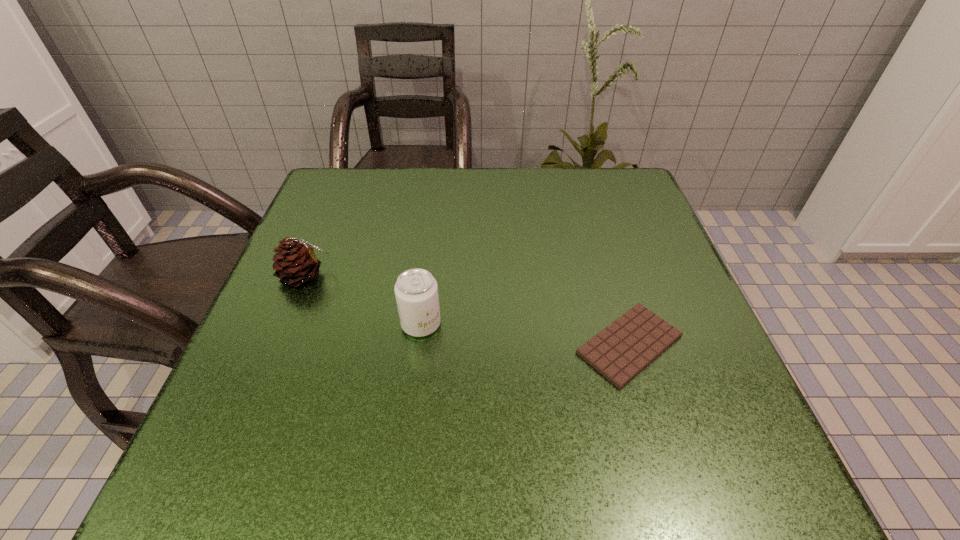
Where is `free spot between the second object from right to left and the chocolate bar`? The height and width of the screenshot is (540, 960). free spot between the second object from right to left and the chocolate bar is located at coordinates (525, 334).

Locate an element on the screen. free spot between the rightmost object and the second object from right to left is located at coordinates (525, 334).

Find the location of a particular element. The height and width of the screenshot is (540, 960). vacant area that lies between the soda can and the pinecone is located at coordinates (363, 300).

I want to click on vacant space in between the farthest object and the soda can, so click(x=363, y=300).

Locate an element on the screen. vacant area that lies between the chocolate bar and the soda can is located at coordinates (525, 334).

Where is `vacant area between the chocolate bar and the second object from left to right`? Image resolution: width=960 pixels, height=540 pixels. vacant area between the chocolate bar and the second object from left to right is located at coordinates (525, 334).

Choose which object is the nearest neighbor to the farthest object. Please provide its 2D coordinates. Your answer should be formatted as a tuple, i.e. [(x, y)], where the tuple contains the x and y coordinates of a point satisfying the conditions above.

[(416, 290)]

Identify which object is located as the nearest to the chocolate bar. Please provide its 2D coordinates. Your answer should be formatted as a tuple, i.e. [(x, y)], where the tuple contains the x and y coordinates of a point satisfying the conditions above.

[(416, 290)]

Identify the location of free space that satisfies the following two spatial constraints: 1. with a leaf charm attached to the leftmost object; 2. on the left side of the soda can. The height and width of the screenshot is (540, 960). (285, 324).

Where is `vacant position in the image that satisfies the following two spatial constraints: 1. on the back side of the second object from right to left; 2. with a leaf charm attached to the farthest object`? The image size is (960, 540). vacant position in the image that satisfies the following two spatial constraints: 1. on the back side of the second object from right to left; 2. with a leaf charm attached to the farthest object is located at coordinates (427, 276).